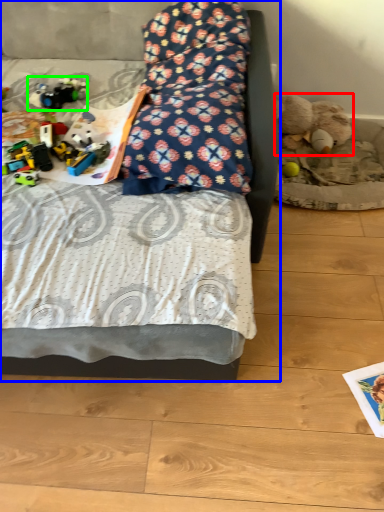
Question: Based on their relative distances, which object is farther from teddy bear (highlighted by a red box)? Choose from bed (highlighted by a blue box) and toy (highlighted by a green box).

Choices:
 (A) bed
 (B) toy

Answer: (A)